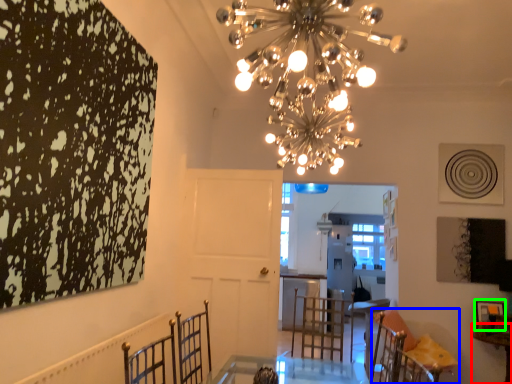
Question: Considering the real-world distances, which object is farthest from table (highlighted by a red box)? furniture (highlighted by a blue box) or picture frame (highlighted by a green box)?

Choices:
 (A) furniture
 (B) picture frame

Answer: (A)